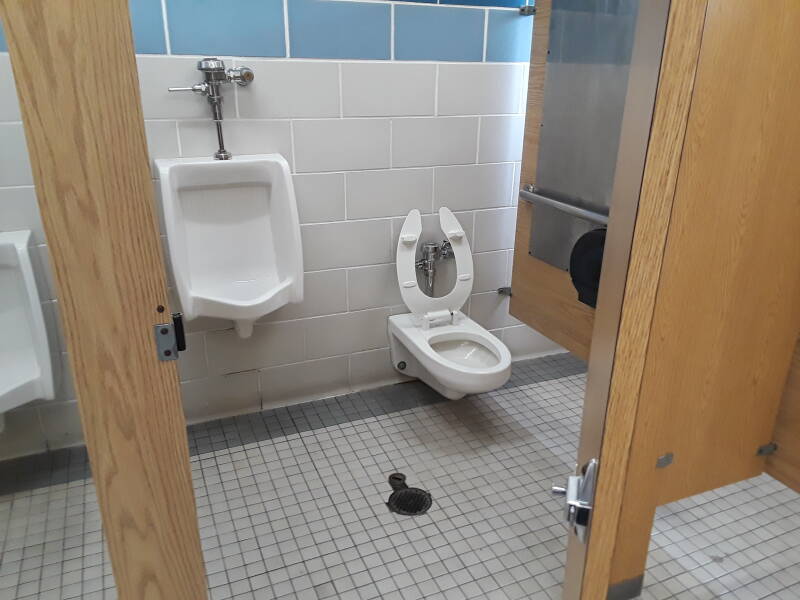
This screenshot has width=800, height=600. Identify the location of toilet. (416, 346).